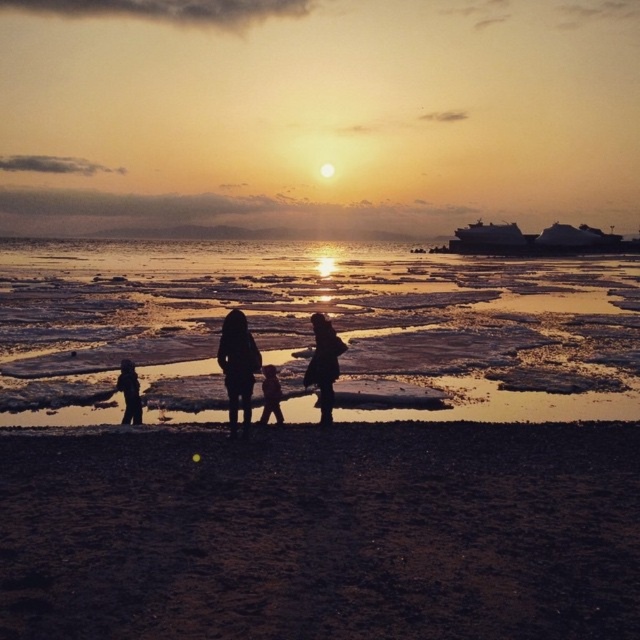
Which is behind, point (595, 540) or point (328, 404)?

The point (328, 404) is behind.

Can you confirm if dark sand at lower center is taller than silhouette clothing at center?

Indeed, dark sand at lower center has a greater height compared to silhouette clothing at center.

Describe the element at coordinates (323, 532) in the screenshot. I see `dark sand at lower center` at that location.

At what (x,y) coordinates should I click in order to perform the action: click on dark sand at lower center. Please return your answer as a coordinate pair (x, y). Image resolution: width=640 pixels, height=640 pixels. Looking at the image, I should click on (323, 532).

Between point (332, 381) and point (262, 403), which one is positioned behind?

The point (262, 403) is more distant.

Based on the photo, which is more to the right, silhouette clothing at center or smooth skin child at center?

silhouette clothing at center is more to the right.

At what (x,y) coordinates should I click in order to perform the action: click on silhouette clothing at center. Please return your answer as a coordinate pair (x, y). Looking at the image, I should click on (323, 364).

Can you confirm if silhouette figure at center is positioned to the right of smooth skin child at center?

No, silhouette figure at center is not to the right of smooth skin child at center.

Consider the image. Is silhouette figure at center above smooth skin child at center?

No, silhouette figure at center is not above smooth skin child at center.

This screenshot has width=640, height=640. I want to click on silhouette figure at center, so click(237, 365).